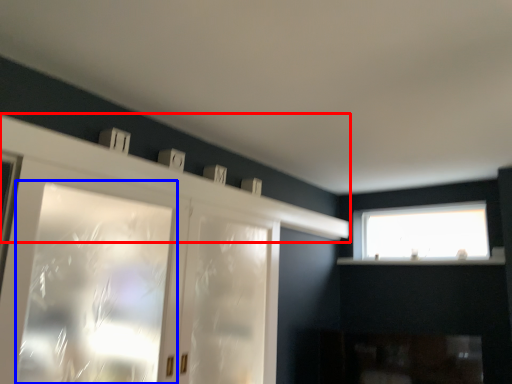
Question: Which of the following is the farthest to the observer, mantle (highlighted by a red box) or window (highlighted by a blue box)?

Choices:
 (A) mantle
 (B) window

Answer: (A)